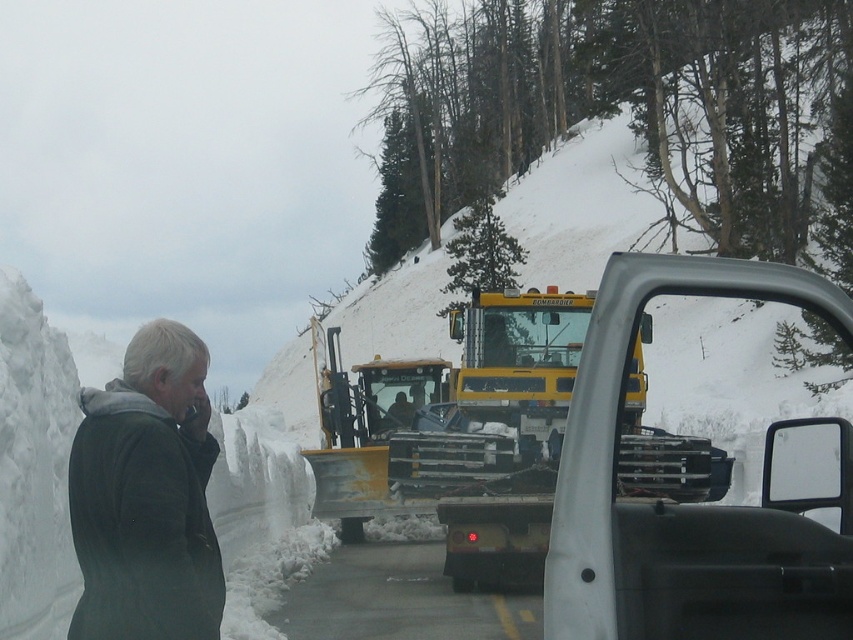
Question: Which point appears closest to the camera in this image?

Choices:
 (A) (97, 449)
 (B) (622, 321)

Answer: (B)

Question: Which object is closer to the camera taking this photo?

Choices:
 (A) metallic silver trailer truck at center
 (B) dark gray jacket at left

Answer: (A)

Question: Observing the image, what is the correct spatial positioning of metallic silver trailer truck at center in reference to dark gray jacket at left?

Choices:
 (A) below
 (B) above

Answer: (B)

Question: Considering the relative positions of metallic silver trailer truck at center and dark gray jacket at left in the image provided, where is metallic silver trailer truck at center located with respect to dark gray jacket at left?

Choices:
 (A) above
 (B) below

Answer: (A)

Question: Does metallic silver trailer truck at center lie in front of dark gray jacket at left?

Choices:
 (A) yes
 (B) no

Answer: (A)

Question: Which point is farther to the camera?

Choices:
 (A) dark gray jacket at left
 (B) metallic silver trailer truck at center

Answer: (A)